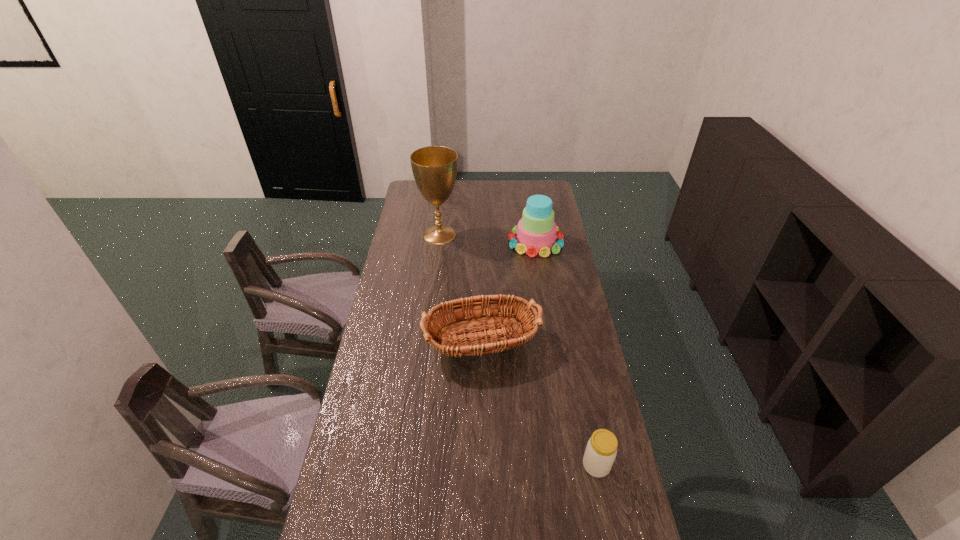
This screenshot has height=540, width=960. I want to click on empty location between the shortest object and the second tallest object, so click(x=565, y=354).

Where is `empty space that is in between the cake and the tallest object`? The image size is (960, 540). empty space that is in between the cake and the tallest object is located at coordinates (488, 238).

This screenshot has height=540, width=960. Identify the location of free space between the tallest object and the third shortest object. (488, 238).

You are a GUI agent. You are given a task and a screenshot of the screen. Output one action in this format:
    pyautogui.click(x=<x>, y=<y>)
    Task: Click on the object that is the closest to the cake
    
    Given the screenshot: What is the action you would take?
    pyautogui.click(x=434, y=168)

Locate an element on the screen. The height and width of the screenshot is (540, 960). object that is the second nearest to the second nearest object is located at coordinates (536, 232).